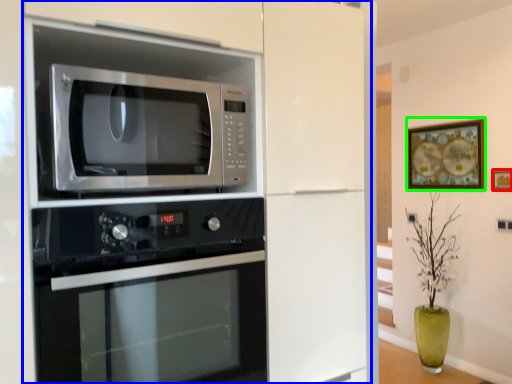
Question: Estimate the real-world distances between objects in this image. Which object is farther from picture frame (highlighted by a red box), cabinetry (highlighted by a blue box) or picture frame (highlighted by a green box)?

Choices:
 (A) cabinetry
 (B) picture frame

Answer: (A)